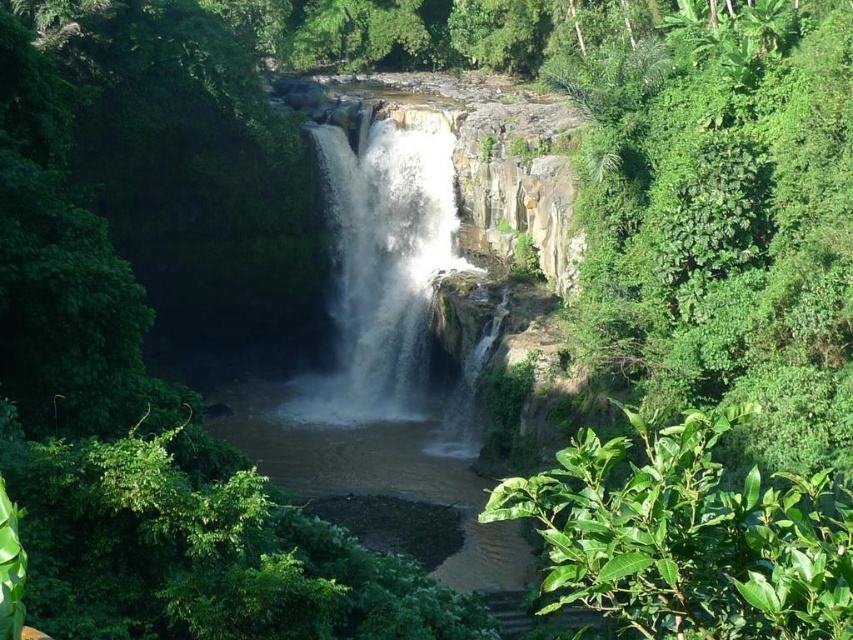
Question: Which point is closer to the camera taking this photo?

Choices:
 (A) (721, 540)
 (B) (450, 170)

Answer: (A)

Question: Can you confirm if green leafy plant at lower right is thinner than white frothy water at center?

Choices:
 (A) no
 (B) yes

Answer: (A)

Question: Which point is farther from the camera taking this photo?

Choices:
 (A) (300, 408)
 (B) (621, 618)

Answer: (A)

Question: Does green leafy plant at lower right have a greater width compared to white frothy water at center?

Choices:
 (A) no
 (B) yes

Answer: (B)

Question: Can you confirm if green leafy plant at lower right is positioned below white frothy water at center?

Choices:
 (A) yes
 (B) no

Answer: (A)